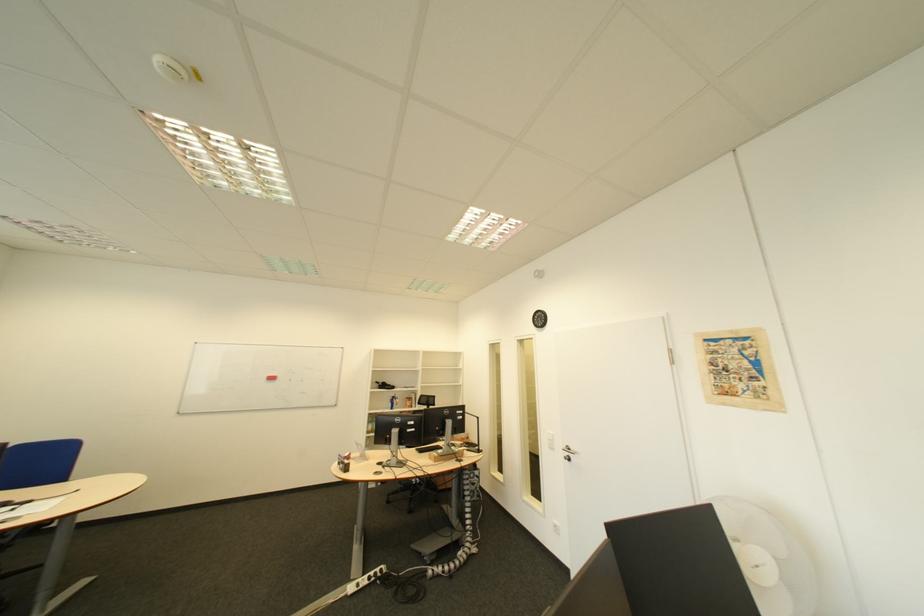
Where is `black telephone handset`? black telephone handset is located at coordinates (383, 385).